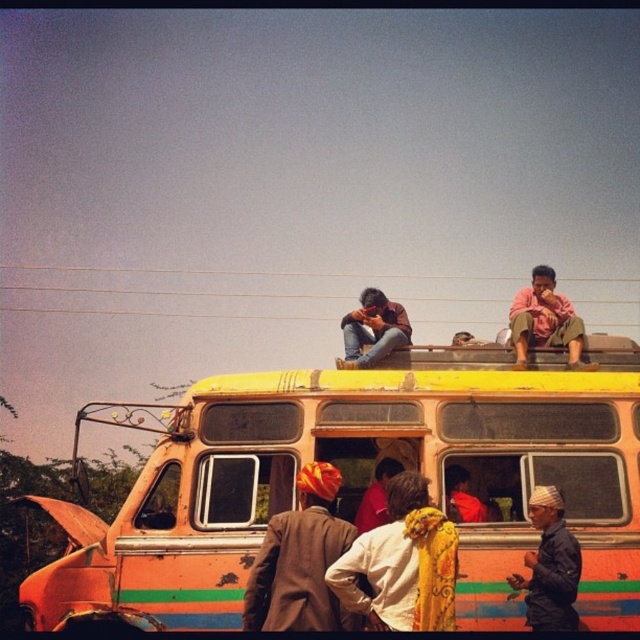
You are standing in front of the vintage bus and want to determine which of the two points, point 1 at coordinates point (x=280, y=630) or point 2 at coordinates point (x=456, y=493), is closer to you. Can you tell which one is nearer?

Point 1 at coordinates point (x=280, y=630) is closer to the viewer than point 2 at coordinates point (x=456, y=493).

You are standing 50 feet away from the vintage bus. You want to take a photo of the yellow fabric headscarf at center. Is the headscarf within your camera range if the camera can focus up to 50 feet?

The yellow fabric headscarf at center is 51.43 feet away from the viewer, which is beyond the camera focus range of 50 feet. Therefore, the camera cannot focus on the headscarf.